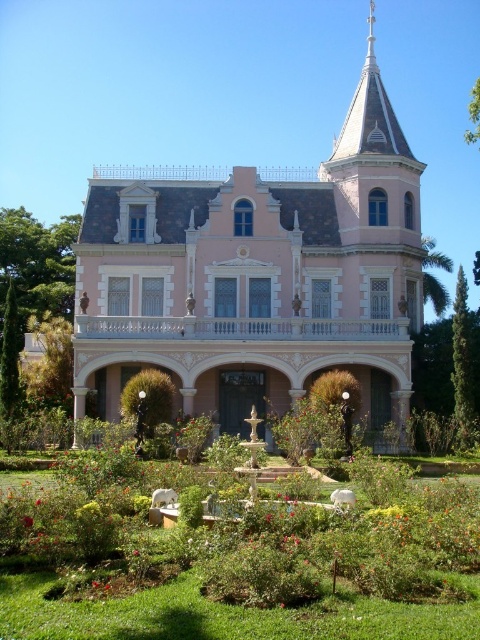
You are a landscape architect designing a garden around the pink wood mansion at center and green leafy bushes at center. If the mansion is wider than the bushes, how should you arrange the bushes to ensure they are proportionate to the mansion?

The pink wood mansion at center is wider than the green leafy bushes at center. To ensure proportionality, the bushes should be placed in a symmetrical pattern flanking the mansion or arranged in clusters to balance the mansion width without overwhelming its presence.